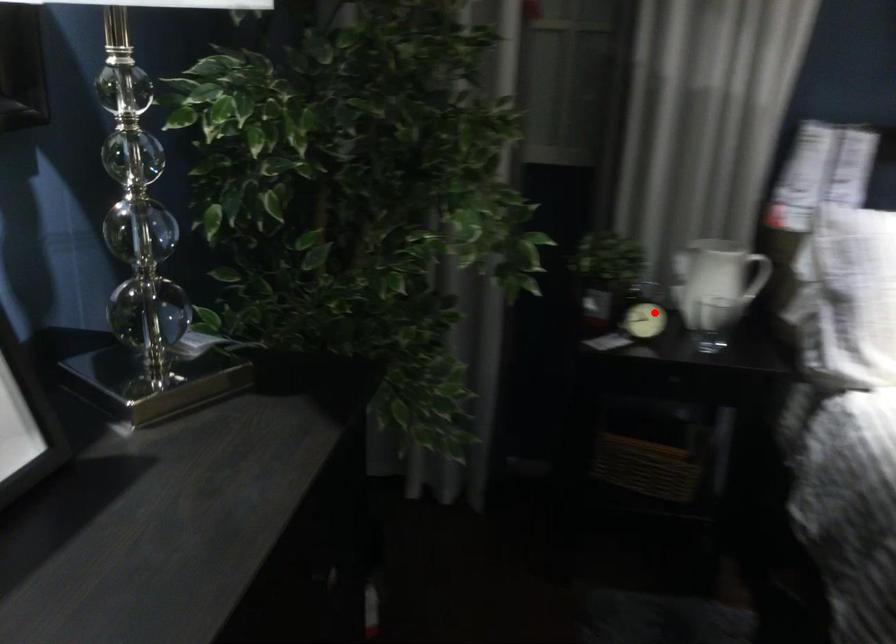
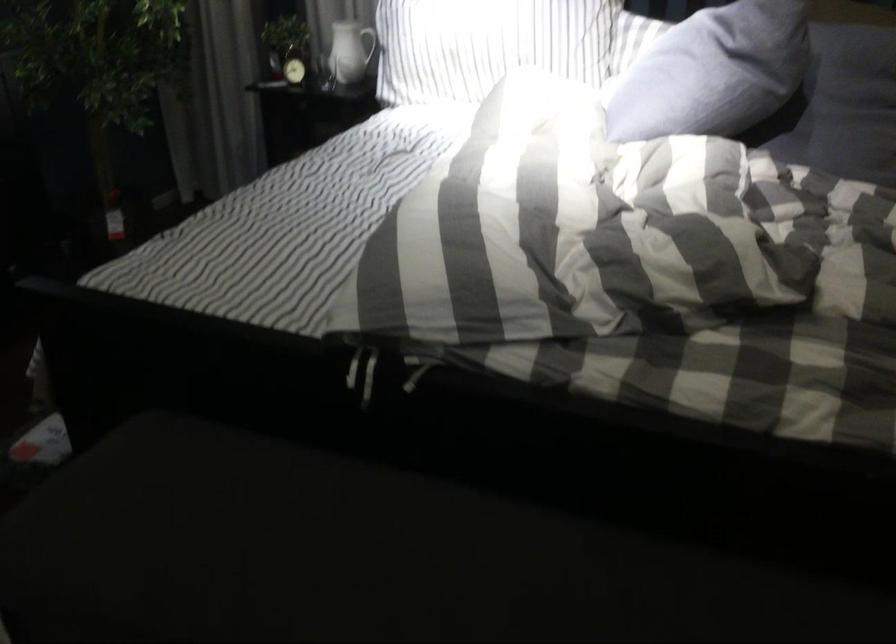
Locate, in the second image, the point that corresponds to the highlighted location in the first image.

(294, 62)